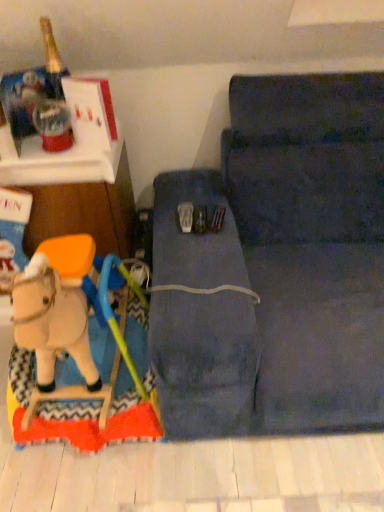
Question: Is point (97, 267) closer or farther from the camera than point (125, 181)?

Choices:
 (A) farther
 (B) closer

Answer: (B)

Question: Is wooden matte horse at lower left in front of or behind wooden rocking horse at left in the image?

Choices:
 (A) front
 (B) behind

Answer: (A)

Question: Which object is the farthest from the wooden rocking horse at left?

Choices:
 (A) dark blue fabric studio couch at center
 (B) wooden matte horse at lower left

Answer: (A)

Question: Which object is positioned closest to the wooden rocking horse at left?

Choices:
 (A) wooden matte horse at lower left
 (B) dark blue fabric studio couch at center

Answer: (A)